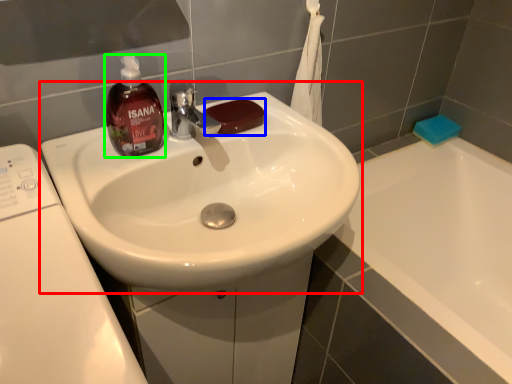
Question: Which object is the farthest from sink (highlighted by a red box)? Choose among these: soap (highlighted by a blue box) or bottle (highlighted by a green box).

Choices:
 (A) soap
 (B) bottle

Answer: (A)